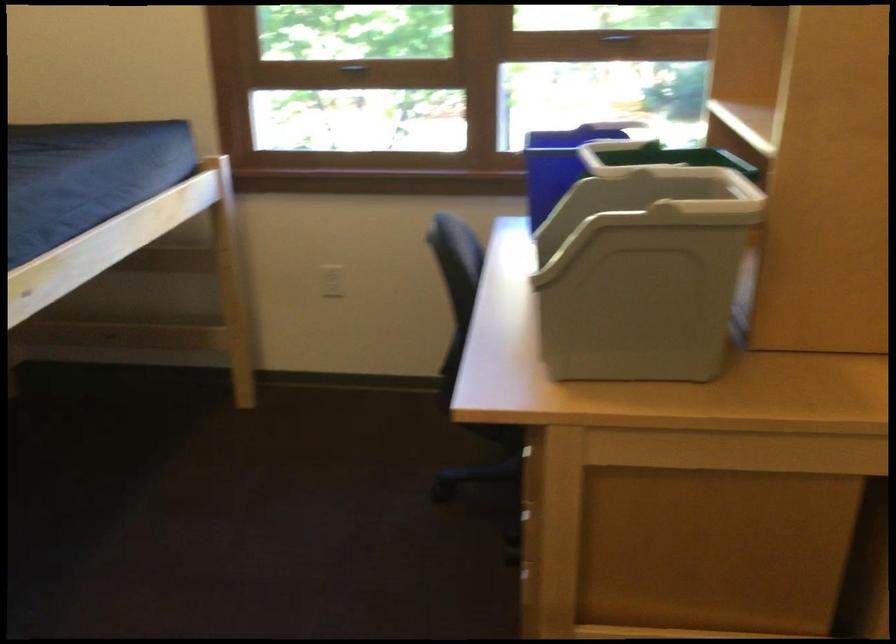
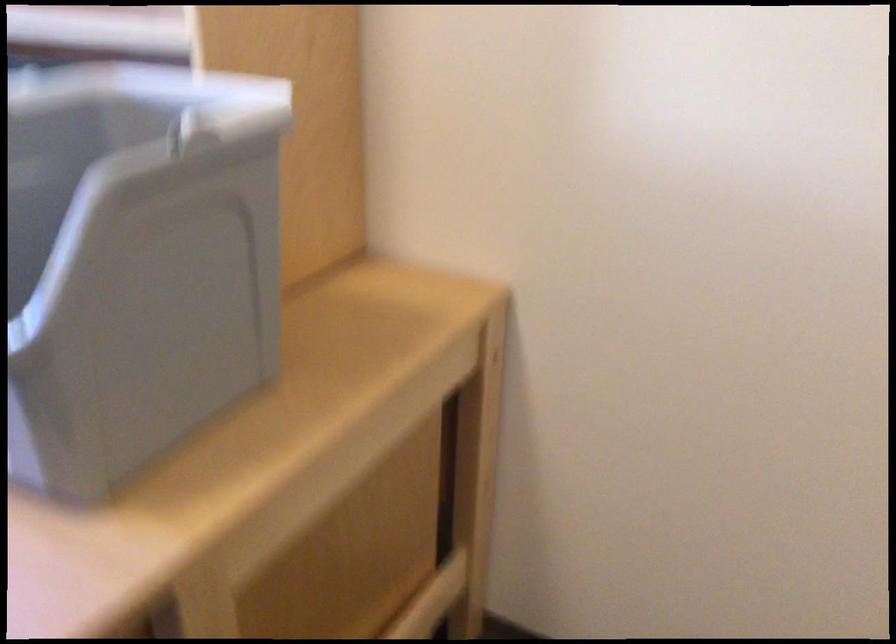
The images are taken continuously from a first-person perspective. In which direction is your viewpoint rotating?

The camera rotated toward right-down.